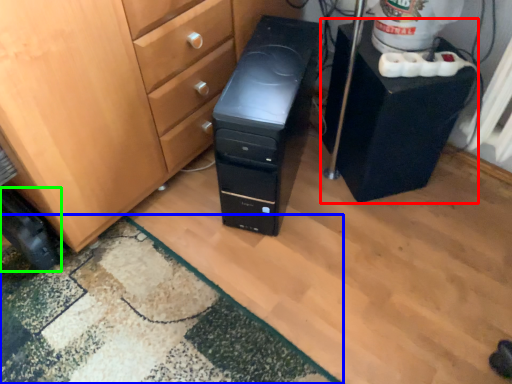
Question: Considering the real-world distances, which object is closest to furniture (highlighted by a red box)? doormat (highlighted by a blue box) or wheel (highlighted by a green box).

Choices:
 (A) doormat
 (B) wheel

Answer: (A)